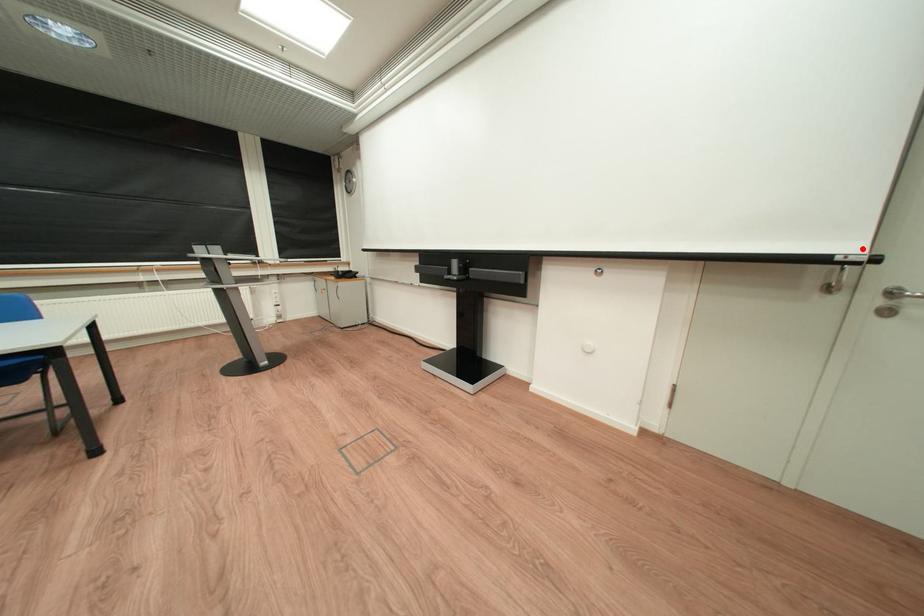
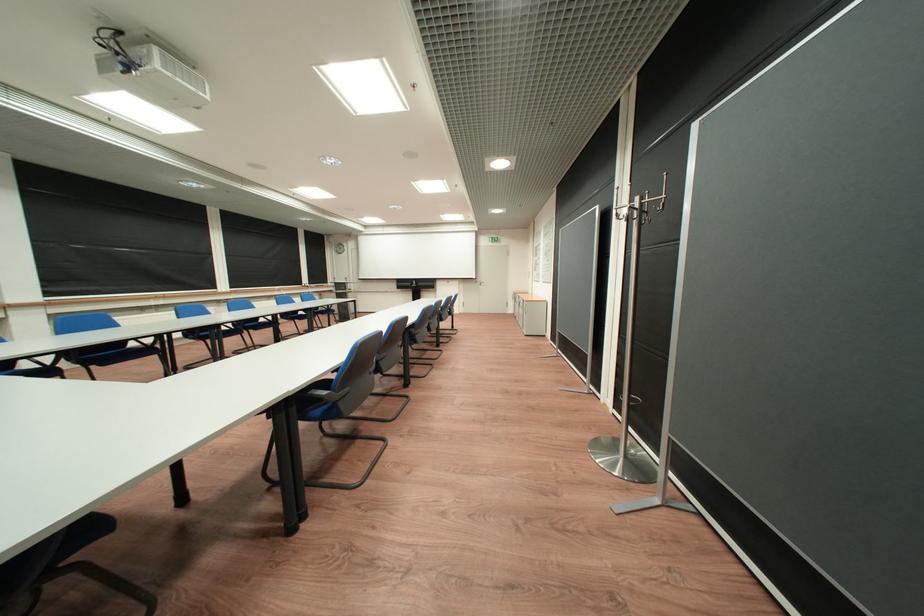
Question: I am providing you with two images of the same scene from different viewpoints. A red point is shown in image1. For the corresponding object point in image2, is it positioned nearer or farther from the camera?

Choices:
 (A) Nearer
 (B) Farther

Answer: (A)